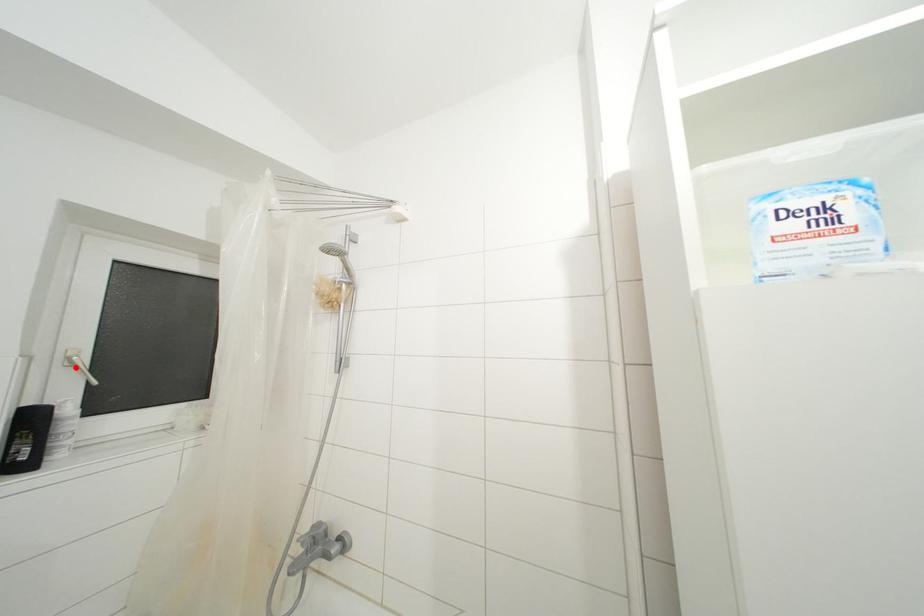
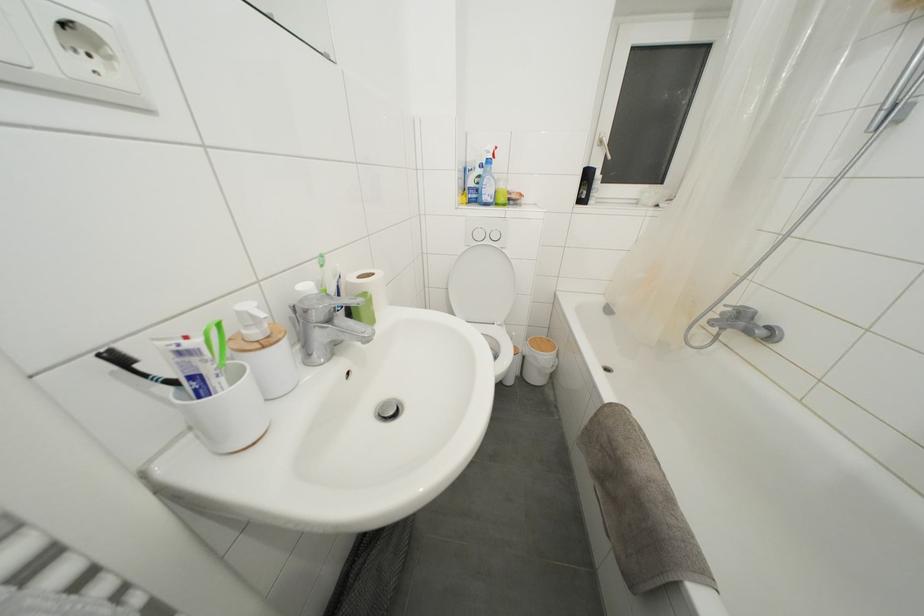
Question: I am providing you with two images of the same scene from different viewpoints. Given a red point in image1, look at the same physical point in image2. Is it:

Choices:
 (A) Closer to the viewpoint
 (B) Farther from the viewpoint

Answer: (A)